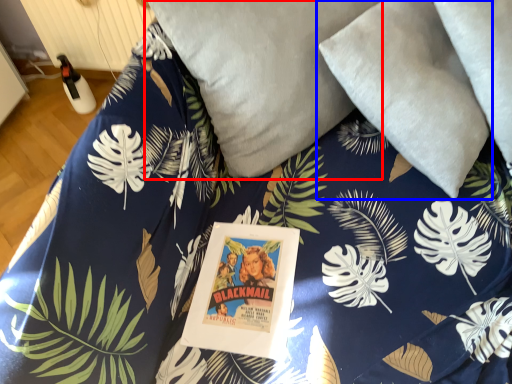
Question: Which of the following is the farthest to the observer, pillow (highlighted by a red box) or pillow (highlighted by a blue box)?

Choices:
 (A) pillow
 (B) pillow

Answer: (A)